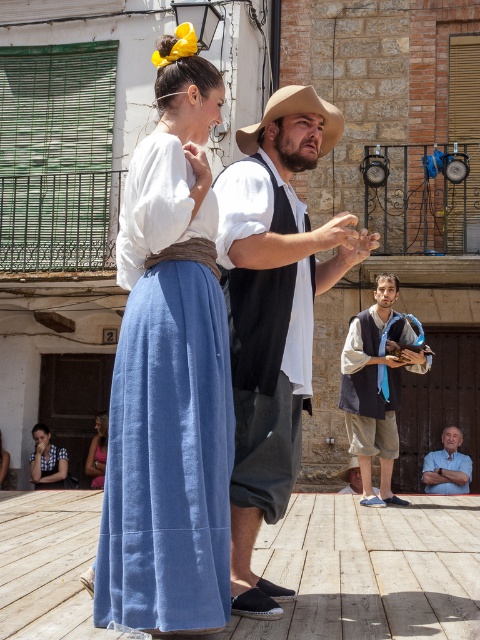
You are a photographer standing in the town square and want to capture both the light blue shirt at lower right and the silky pink dress at lower left in the same frame. Your camera has a maximum focus range that can capture objects up to 5 meters apart. Can you fit both subjects into the frame without moving your position?

The distance between the light blue shirt at lower right and the silky pink dress at lower left is 4.57 meters, which is within the camera maximum focus range of 5 meters. Therefore, you can capture both subjects in the same frame without moving.

You are an event photographer trying to capture a clear shot of the matte white blouse at upper left and the matte white shirt at center. Which one is closer to the camera?

The matte white blouse at upper left is in front of the matte white shirt at center, so it is closer to the camera.